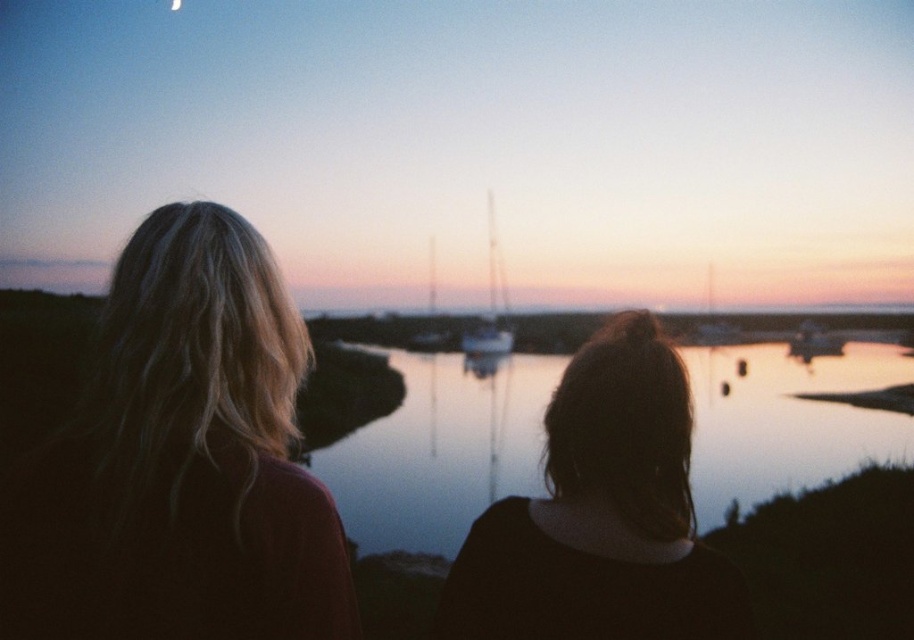
Question: Is glossy water at center positioned in front of metallic sailboat at center?

Choices:
 (A) no
 (B) yes

Answer: (B)

Question: Does white glossy sailboat at center have a greater width compared to metallic sailboat at center?

Choices:
 (A) yes
 (B) no

Answer: (A)

Question: Is blonde hair at left bigger than white glossy sailboat at center?

Choices:
 (A) no
 (B) yes

Answer: (A)

Question: Which of the following is the closest to the observer?

Choices:
 (A) glossy water at center
 (B) metallic sailboat at center
 (C) blonde hair at left
 (D) white glossy sailboat at center

Answer: (C)

Question: Among these points, which one is nearest to the camera?

Choices:
 (A) (511, 339)
 (B) (464, 570)
 (C) (433, 304)
 (D) (264, 358)

Answer: (D)

Question: Which point is closer to the camera taking this photo?

Choices:
 (A) (859, 436)
 (B) (506, 326)
 (C) (628, 419)

Answer: (C)